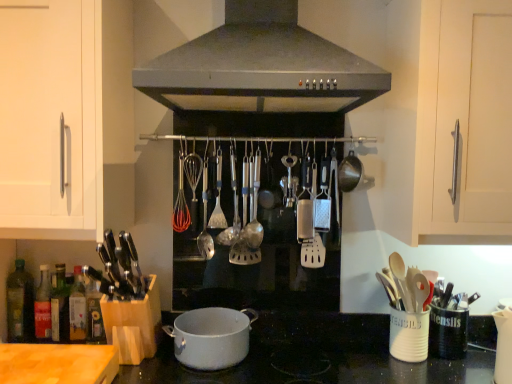
Locate an element on the screen. silver metallic spoon at center, which appears as the first utensil when viewed from the left is located at coordinates pyautogui.click(x=205, y=220).

Identify the location of white ceramic utensil holder at lower right. The width and height of the screenshot is (512, 384). (409, 335).

Where is `cabinetry in front of the silver metallic spoon at center, which appears as the first utensil when viewed from the left`? The height and width of the screenshot is (384, 512). cabinetry in front of the silver metallic spoon at center, which appears as the first utensil when viewed from the left is located at coordinates (63, 114).

From a real-world perspective, is white matte cabinet handle at upper left physically below silver metallic spoon at center, which appears as the first utensil when viewed from the left?

No, from a real-world perspective, white matte cabinet handle at upper left is not beneath silver metallic spoon at center, which appears as the first utensil when viewed from the left.

Can you confirm if white matte cabinet handle at upper left is wider than silver metallic spoon at center, which appears as the first utensil when viewed from the left?

Correct, the width of white matte cabinet handle at upper left exceeds that of silver metallic spoon at center, which appears as the first utensil when viewed from the left.

Is white matte cabinet handle at upper left far from silver metallic spoon at center, the third utensil viewed from the right?

Actually, white matte cabinet handle at upper left and silver metallic spoon at center, the third utensil viewed from the right, are a little close together.

In the image, is silver metallic spoon at center, which appears as the first utensil when viewed from the left, positioned in front of or behind white matte pot at center?

silver metallic spoon at center, which appears as the first utensil when viewed from the left, is behind white matte pot at center.

Is silver metallic spoon at center, which appears as the first utensil when viewed from the left, situated inside white matte pot at center or outside?

silver metallic spoon at center, which appears as the first utensil when viewed from the left, exists outside the volume of white matte pot at center.

Based on their positions, is silver metallic spoon at center, which appears as the first utensil when viewed from the left, located to the left or right of white matte pot at center?

silver metallic spoon at center, which appears as the first utensil when viewed from the left, is positioned on white matte pot at center's left side.

Is silver metallic spoon at center, the third utensil viewed from the right, positioned far away from white matte pot at center?

Actually, silver metallic spoon at center, the third utensil viewed from the right, and white matte pot at center are a little close together.

Is white ceramic utensil holder at lower right beside satin silver spoon at center, acting as the first utensil starting from the right?

No, white ceramic utensil holder at lower right is not in contact with satin silver spoon at center, acting as the first utensil starting from the right.

Between white ceramic utensil holder at lower right and satin silver spoon at center, the third utensil when ordered from left to right, which one has larger size?

white ceramic utensil holder at lower right is bigger.

Considering the relative sizes of white ceramic utensil holder at lower right and satin silver spoon at center, acting as the first utensil starting from the right, in the image provided, is white ceramic utensil holder at lower right thinner than satin silver spoon at center, acting as the first utensil starting from the right,?

No, white ceramic utensil holder at lower right is not thinner than satin silver spoon at center, acting as the first utensil starting from the right.

Is point (392, 307) behind point (15, 306)?

No, it is not.

The height and width of the screenshot is (384, 512). I want to click on appliance below the green glass bottle at lower left (from a real-world perspective), so click(409, 335).

Does white ceramic utensil holder at lower right come behind green glass bottle at lower left?

No.

Which of these two, white ceramic utensil holder at lower right or green glass bottle at lower left, is wider?

Wider between the two is white ceramic utensil holder at lower right.

Is white matte cabinet handle at upper left looking in the opposite direction of white ceramic utensil holder at lower right?

white matte cabinet handle at upper left is not turned away from white ceramic utensil holder at lower right.

Does point (109, 110) appear closer or farther from the camera than point (425, 359)?

Point (109, 110) is closer to the camera than point (425, 359).

From a real-world perspective, is white matte cabinet handle at upper left located higher than white ceramic utensil holder at lower right?

Yes, from a real-world perspective, white matte cabinet handle at upper left is on top of white ceramic utensil holder at lower right.

Does white matte cabinet handle at upper left lie behind white ceramic utensil holder at lower right?

No, the depth of white matte cabinet handle at upper left is less than that of white ceramic utensil holder at lower right.

Who is smaller, wooden cutting board at lower left or white matte cabinet handle at upper left?

wooden cutting board at lower left is smaller.

Is wooden cutting board at lower left turned away from white matte cabinet handle at upper left?

wooden cutting board at lower left is not turned away from white matte cabinet handle at upper left.

This screenshot has width=512, height=384. Identify the location of counter top lying below the white matte cabinet handle at upper left (from the image's perspective). (57, 364).

In the scene shown: Would you say wooden cutting board at lower left contains white matte cabinet handle at upper left?

No.

From a real-world perspective, is satin silver spoon at center, acting as the first utensil starting from the right, above or below white matte pot at center?

In terms of real-world spatial position, satin silver spoon at center, acting as the first utensil starting from the right, is above white matte pot at center.

Can you tell me how much satin silver spoon at center, the third utensil when ordered from left to right, and white matte pot at center differ in facing direction?

0.467 degrees.

From the image's perspective, would you say satin silver spoon at center, acting as the first utensil starting from the right, is shown under white matte pot at center?

No, from the image's perspective, satin silver spoon at center, acting as the first utensil starting from the right, is not beneath white matte pot at center.

Find the location of a particular element. kitchen appliance below the satin silver spoon at center, acting as the first utensil starting from the right (from the image's perspective) is located at coordinates (211, 337).

There is a white matte cabinet handle at upper left. At what (x,y) coordinates should I click in order to perform the action: click on the 3rd utensil below it (from a real-world perspective). Please return your answer as a coordinate pair (x, y). Looking at the image, I should click on (205, 220).

Locate an element on the screen. kitchen appliance located on the right of silver metallic spoon at center, the third utensil viewed from the right is located at coordinates (211, 337).

Which object lies nearer to the anchor point silver metallic spoon at center, which appears as the first utensil when viewed from the left, satin silver spoon at center, the third utensil when ordered from left to right, or white matte cabinet handle at upper left?

Based on the image, satin silver spoon at center, the third utensil when ordered from left to right, appears to be nearer to silver metallic spoon at center, which appears as the first utensil when viewed from the left.

Based on the photo, based on their spatial positions, is white matte pot at center or white matte cabinet handle at upper left closer to satin steel range hood at center?

Based on the image, white matte cabinet handle at upper left appears to be nearer to satin steel range hood at center.

From the image, which object appears to be nearer to wooden cutting board at lower left, white matte cabinet handle at upper left or satin silver spoon at center, the third utensil when ordered from left to right?

white matte cabinet handle at upper left.

From the image, which object appears to be farther from satin silver spoon at center, which is the second utensil in left-to-right order, white ceramic utensil holder at lower right or green glass bottle at lower left?

The object further to satin silver spoon at center, which is the second utensil in left-to-right order, is green glass bottle at lower left.

Based on their spatial positions, is wooden spoons at right or white matte pot at center further from satin steel range hood at center?

white matte pot at center lies further to satin steel range hood at center than the other object.

From the image, which object appears to be farther from satin steel range hood at center, satin silver spoon at center, which is the second utensil in left-to-right order, or white matte cabinet handle at upper left?

The object further to satin steel range hood at center is satin silver spoon at center, which is the second utensil in left-to-right order.

Considering their positions, is satin silver spoon at center, which appears as the 2th utensil when viewed from the right, positioned closer to satin steel range hood at center than white ceramic utensil holder at lower right?

satin silver spoon at center, which appears as the 2th utensil when viewed from the right.

Looking at the image, which one is located closer to white matte cabinet handle at upper left, green glass bottle at lower left or silver metallic spoon at center, the third utensil viewed from the right?

Based on the image, silver metallic spoon at center, the third utensil viewed from the right, appears to be nearer to white matte cabinet handle at upper left.

Where is `kitchen appliance situated between green glass bottle at lower left and satin silver spoon at center, acting as the first utensil starting from the right, from left to right`? The image size is (512, 384). kitchen appliance situated between green glass bottle at lower left and satin silver spoon at center, acting as the first utensil starting from the right, from left to right is located at coordinates (211, 337).

You are a GUI agent. You are given a task and a screenshot of the screen. Output one action in this format:
    pyautogui.click(x=<x>, y=<y>)
    Task: Click on the kitchen appliance between green glass bottle at lower left and satin silver spoon at center, which is the second utensil in left-to-right order
    The width and height of the screenshot is (512, 384).
    Given the screenshot: What is the action you would take?
    pyautogui.click(x=211, y=337)

Find the location of a particular element. The image size is (512, 384). cabinetry between green glass bottle at lower left and wooden spoons at right in the horizontal direction is located at coordinates (63, 114).

Locate an element on the screen. This screenshot has height=384, width=512. kitchen appliance between silver metallic spoon at center, which appears as the first utensil when viewed from the left, and white ceramic utensil holder at lower right, in the horizontal direction is located at coordinates (211, 337).